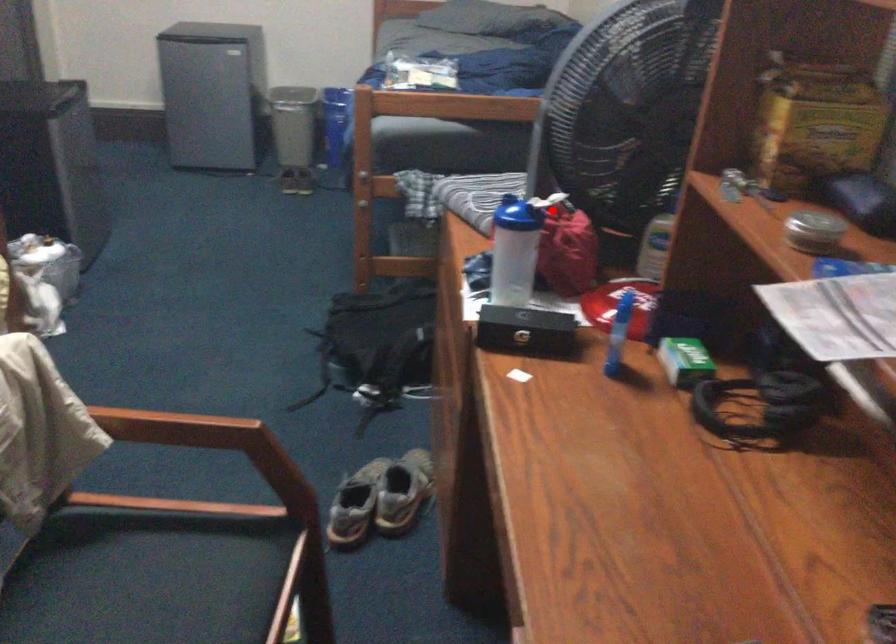
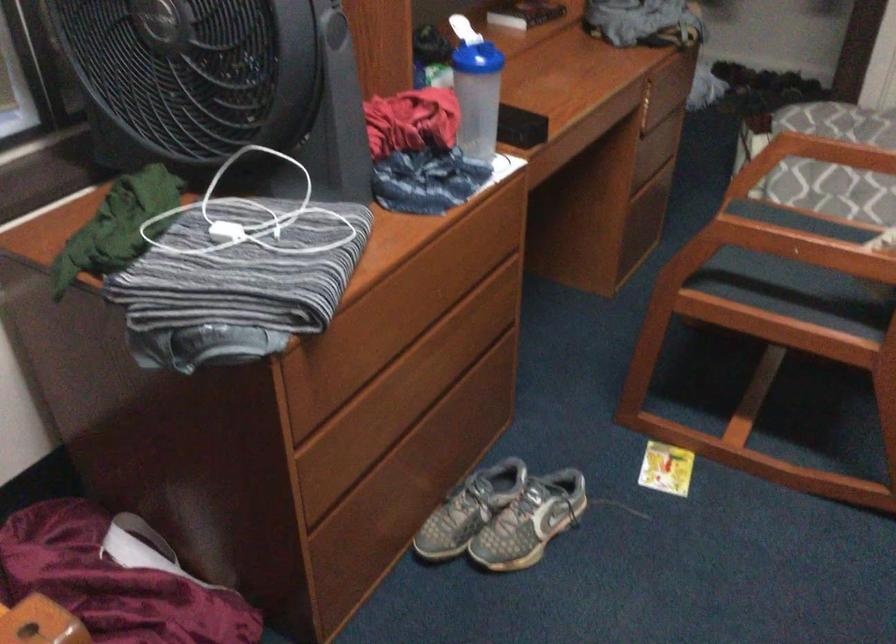
In the second image, find the point that corresponds to the highlighted location in the first image.

(462, 29)